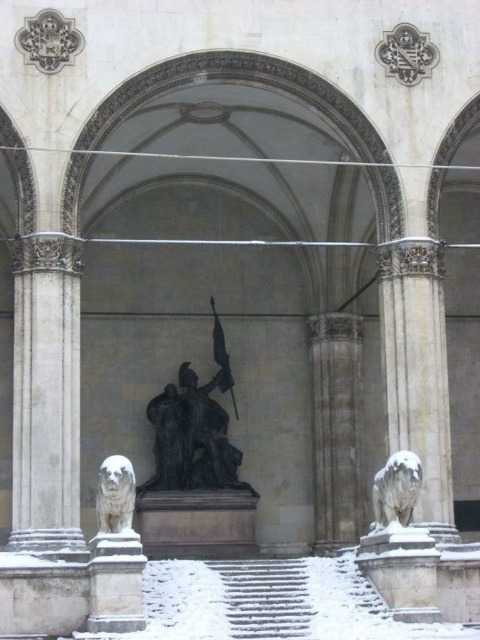
Question: Considering the relative positions of white marble column at left and white stone stairs at center in the image provided, where is white marble column at left located with respect to white stone stairs at center?

Choices:
 (A) below
 (B) above

Answer: (B)

Question: Is black polished statue at center to the right of white marble lion at lower right from the viewer's perspective?

Choices:
 (A) yes
 (B) no

Answer: (B)

Question: Considering the relative positions of white marble lion at right and gray stone column at center in the image provided, where is white marble lion at right located with respect to gray stone column at center?

Choices:
 (A) above
 (B) below

Answer: (A)

Question: Among these points, which one is nearest to the camera?

Choices:
 (A) (284, 579)
 (B) (424, 428)
 (C) (386, 472)
 (D) (359, 358)

Answer: (C)

Question: Among these points, which one is farthest from the camera?

Choices:
 (A) (406, 486)
 (B) (300, 577)

Answer: (B)

Question: Which object is positioned farthest from the gray stone column at center?

Choices:
 (A) white marble dog at center
 (B) white stone stairs at center

Answer: (B)